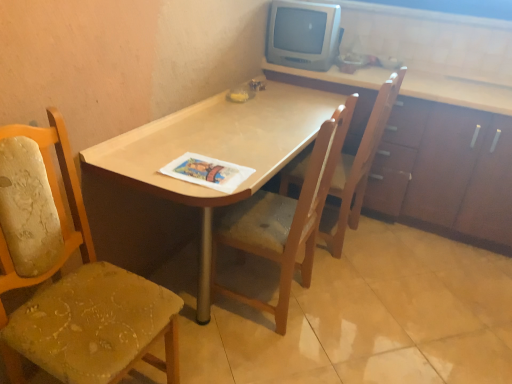
Image resolution: width=512 pixels, height=384 pixels. I want to click on free space to the right of wooden chair at center, which is the 2th chair from left to right, so click(x=352, y=317).